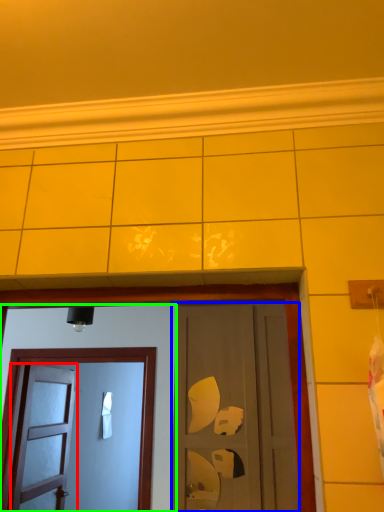
Question: Considering the real-world distances, which object is farthest from door (highlighted by a red box)? door (highlighted by a blue box) or door (highlighted by a green box)?

Choices:
 (A) door
 (B) door

Answer: (A)